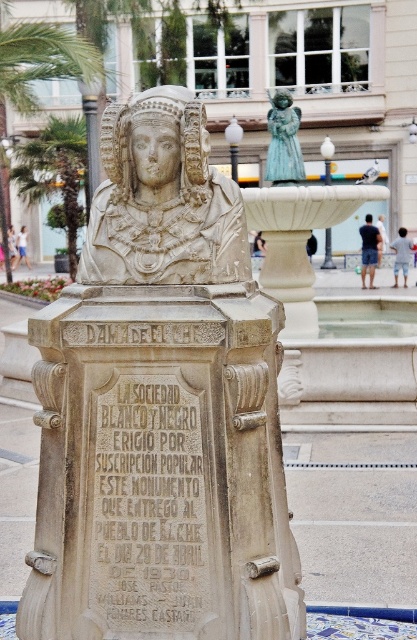
Question: Among these objects, which one is nearest to the camera?

Choices:
 (A) carved stone inscription at center
 (B) green leafy palm tree at left
 (C) green patina statue at center
 (D) stone inscription at center

Answer: (A)

Question: Which object is farther from the camera taking this photo?

Choices:
 (A) beige stone bust at center
 (B) white stone bust at center
 (C) green leafy palm tree at left
 (D) green leafy palm tree at upper left

Answer: (C)

Question: Can you confirm if green leafy palm tree at upper left is positioned above green patina statue at center?

Choices:
 (A) no
 (B) yes

Answer: (B)

Question: Considering the real-world distances, which object is farthest from the green patina statue at center?

Choices:
 (A) stone inscription at center
 (B) carved stone inscription at center

Answer: (B)

Question: Does beige stone bust at center appear over white stone bust at center?

Choices:
 (A) yes
 (B) no

Answer: (B)

Question: Does stone inscription at center appear over green leafy palm tree at left?

Choices:
 (A) no
 (B) yes

Answer: (A)